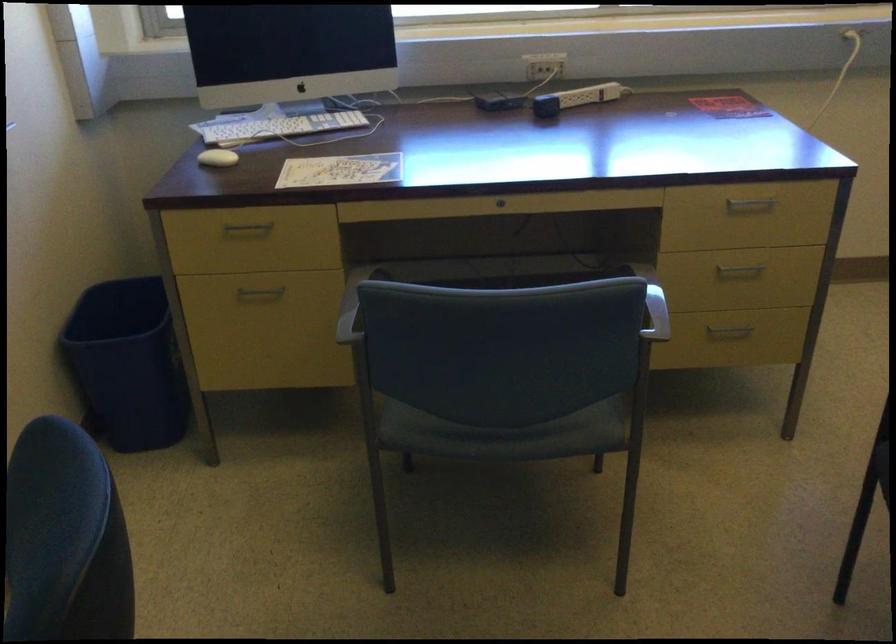
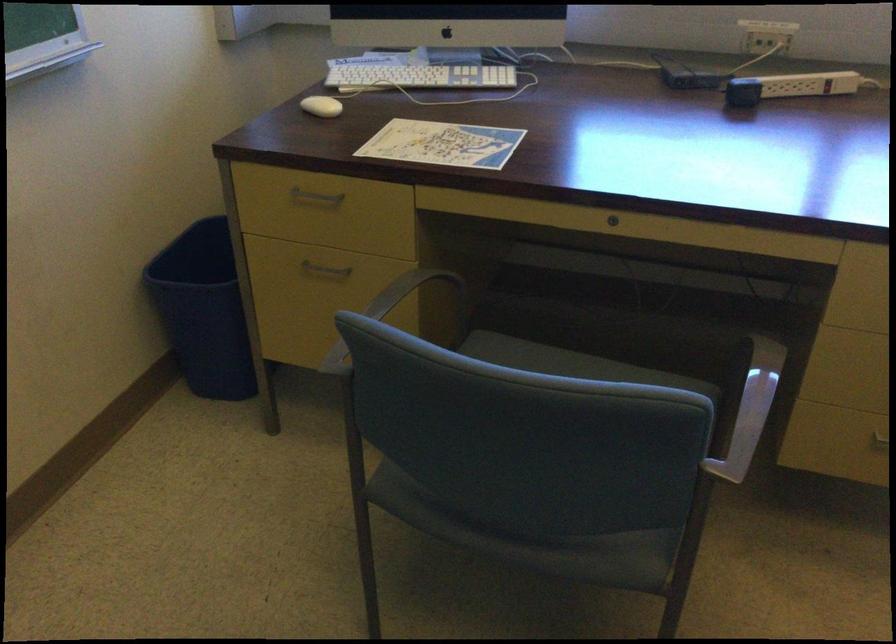
Find the pixel in the second image that matches point 502,203 in the first image.

(613, 220)